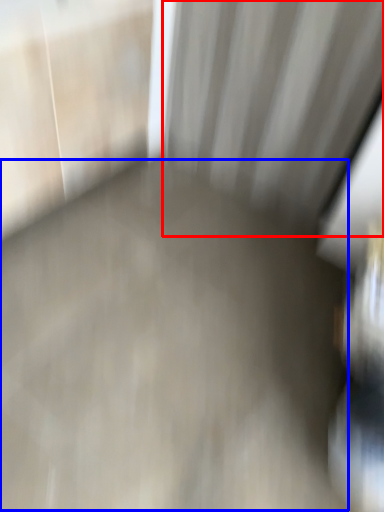
Question: Which object appears closest to the camera in this image, curtain (highlighted by a red box) or concrete (highlighted by a blue box)?

Choices:
 (A) curtain
 (B) concrete

Answer: (B)